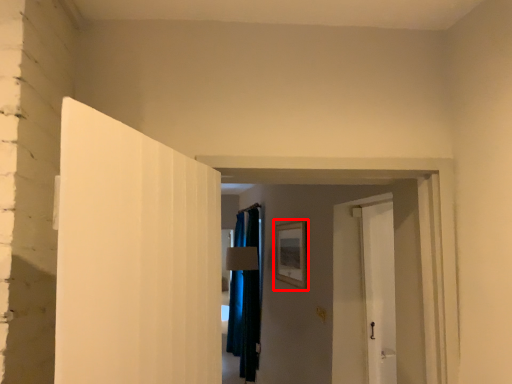
Question: From the image's perspective, considering the relative positions of picture frame (annotated by the red box) and curtain in the image provided, where is picture frame (annotated by the red box) located with respect to the staircase?

Choices:
 (A) below
 (B) above

Answer: (B)